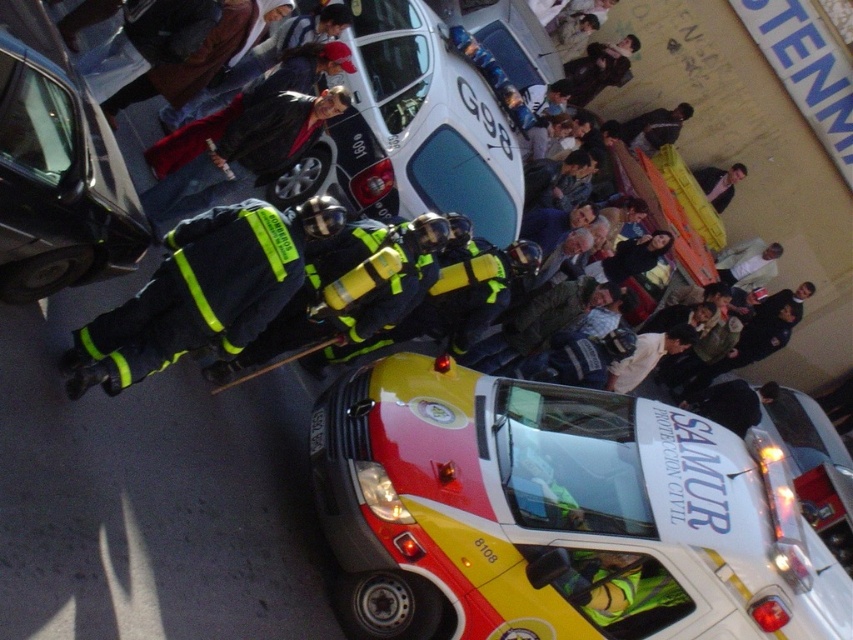
How distant is shiny black car at center from dark blue fabric uniform at left?

shiny black car at center is 81.43 centimeters away from dark blue fabric uniform at left.

Does point (90, 195) lie in front of point (230, 324)?

Yes.

Between point (61, 241) and point (184, 304), which one is positioned behind?

Point (184, 304)

Find the location of `shiny black car at center`. shiny black car at center is located at coordinates (56, 170).

Between shiny black car at center and dark blue uniform at center, which one is positioned higher?

dark blue uniform at center

Is point (71, 124) positioned after point (728, 186)?

No, (71, 124) is in front of (728, 186).

Does point (41, 157) come behind point (715, 182)?

No, it is not.

Where is `shiny black car at center`? The image size is (853, 640). shiny black car at center is located at coordinates (56, 170).

Is yellow and red plastic car at center shorter than shiny black car at center?

No.

Which is below, yellow and red plastic car at center or shiny black car at center?

Positioned lower is yellow and red plastic car at center.

Is point (718, 477) positioned before point (20, 145)?

That is False.

Image resolution: width=853 pixels, height=640 pixels. In order to click on yellow and red plastic car at center in this screenshot , I will do `click(556, 515)`.